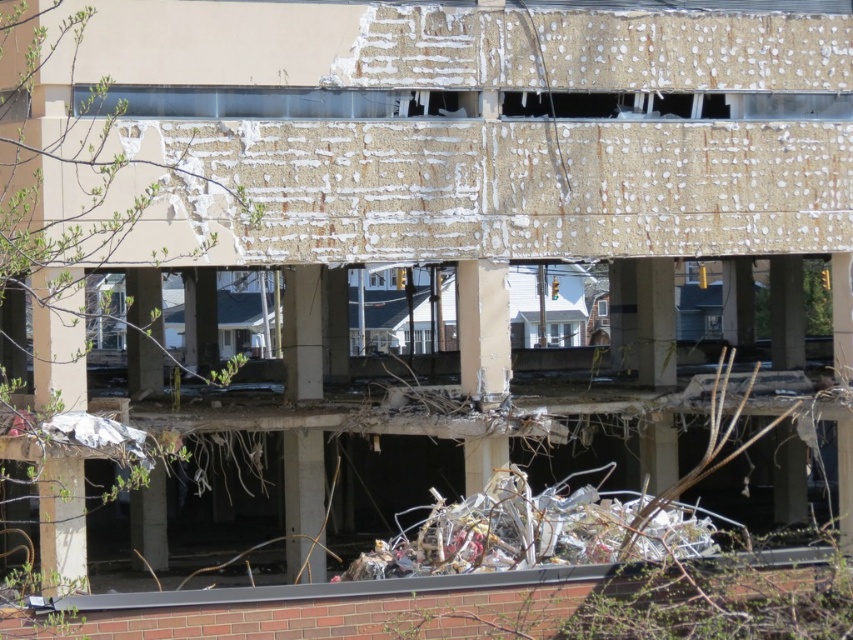
You are standing at the point marked by the coordinates point (503,531) in the image. Looking around, you see the partially demolished building with exposed columns and debris. What object are you standing on?

You are standing on the shiny metallic scrap at center represented by point (503,531).

You are a construction worker assessing the debris in the partially demolished building. You notice the shiny metallic scrap at center and the concrete at center. Which object is taller?

The shiny metallic scrap at center is taller than the concrete at center.